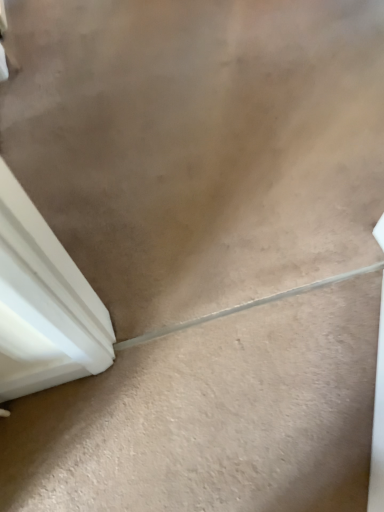
Describe the element at coordinates (212, 416) in the screenshot. I see `beige carpet at lower center` at that location.

What is the approximate height of beige carpet at lower center?

The height of beige carpet at lower center is 0.75 inches.

This screenshot has width=384, height=512. What are the coordinates of `beige carpet at lower center` in the screenshot? It's located at tap(212, 416).

Find the location of a particular element. beige carpet at lower center is located at coordinates tap(212, 416).